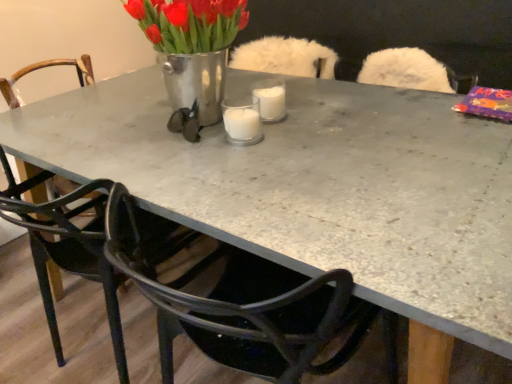
At what (x,y) coordinates should I click in order to perform the action: click on black plastic chair at lower left, positioned as the second chair in left-to-right order. Please return your answer as a coordinate pair (x, y). The width and height of the screenshot is (512, 384). Looking at the image, I should click on point(243,304).

This screenshot has height=384, width=512. Describe the element at coordinates (68, 249) in the screenshot. I see `black metal chair at center, arranged as the first chair when viewed from the left` at that location.

Measure the distance between clear glass candle at center and camera.

A distance of 1.09 meters exists between clear glass candle at center and camera.

Identify the location of black plastic chair at lower left, positioned as the second chair in left-to-right order. Image resolution: width=512 pixels, height=384 pixels. (243, 304).

Measure the distance between metallic vase at center and black plastic chair at lower left, positioned as the second chair in left-to-right order.

metallic vase at center and black plastic chair at lower left, positioned as the second chair in left-to-right order, are 20.07 inches apart from each other.

Is point (216, 121) closer or farther from the camera than point (327, 282)?

Point (216, 121).

Looking at this image, in the image, is metallic vase at center positioned in front of or behind black plastic chair at lower left, which is the first chair from right to left?

Visually, metallic vase at center is located behind black plastic chair at lower left, which is the first chair from right to left.

From a real-world perspective, is metallic vase at center physically below black plastic chair at lower left, which is the first chair from right to left?

Actually, metallic vase at center is physically above black plastic chair at lower left, which is the first chair from right to left, in the real world.

Relative to clear glass candle at center, is metallic vase at center in front or behind?

In the image, metallic vase at center appears in front of clear glass candle at center.

From the image's perspective, is metallic vase at center on top of clear glass candle at center?

Yes, from the image's perspective, metallic vase at center is on top of clear glass candle at center.

Is metallic vase at center facing away from clear glass candle at center?

No, clear glass candle at center is not at the back of metallic vase at center.

Which of these two, metallic vase at center or clear glass candle at center, stands taller?

Standing taller between the two is metallic vase at center.

Between black metal chair at center, arranged as the first chair when viewed from the left, and metallic vase at center, which one has smaller width?

With smaller width is metallic vase at center.

From the image's perspective, between black metal chair at center, acting as the second chair starting from the right, and metallic vase at center, which one is located above?

metallic vase at center appears higher in the image.

From their relative heights in the image, would you say black metal chair at center, arranged as the first chair when viewed from the left, is taller or shorter than metallic vase at center?

In the image, black metal chair at center, arranged as the first chair when viewed from the left, appears to be taller than metallic vase at center.

Which is more to the right, black metal chair at center, arranged as the first chair when viewed from the left, or metallic vase at center?

metallic vase at center.

Is black plastic chair at lower left, positioned as the second chair in left-to-right order, facing towards metallic vase at center?

No, black plastic chair at lower left, positioned as the second chair in left-to-right order, does not turn towards metallic vase at center.

How many degrees apart are the facing directions of black plastic chair at lower left, positioned as the second chair in left-to-right order, and metallic vase at center?

The facing directions of black plastic chair at lower left, positioned as the second chair in left-to-right order, and metallic vase at center are 180 degrees apart.

Is point (384, 313) closer or farther from the camera than point (223, 66)?

Point (384, 313) is positioned closer to the camera compared to point (223, 66).

Between black plastic chair at lower left, which is the first chair from right to left, and metallic vase at center, which one is positioned in front?

black plastic chair at lower left, which is the first chair from right to left, is more forward.

Is metallic vase at center a part of clear glass candle at center?

No, metallic vase at center is not inside clear glass candle at center.

Would you say clear glass candle at center is a long distance from metallic vase at center?

Actually, clear glass candle at center and metallic vase at center are a little close together.

From a real-world perspective, is clear glass candle at center below metallic vase at center?

Correct, in the physical world, clear glass candle at center is lower than metallic vase at center.

Is the depth of clear glass candle at center greater than that of metallic vase at center?

Yes, it is behind metallic vase at center.

Between clear glass candle at center and black metal chair at center, arranged as the first chair when viewed from the left, which one has smaller width?

clear glass candle at center is thinner.

Identify the location of candle holder above the black metal chair at center, arranged as the first chair when viewed from the left (from the image's perspective). (253, 111).

From a real-world perspective, relative to black metal chair at center, arranged as the first chair when viewed from the left, is clear glass candle at center vertically above or below?

clear glass candle at center is above black metal chair at center, arranged as the first chair when viewed from the left.

Is point (272, 104) closer to viewer compared to point (124, 347)?

Yes.

Is black metal chair at center, acting as the second chair starting from the right, completely or partially outside of black plastic chair at lower left, which is the first chair from right to left?

black metal chair at center, acting as the second chair starting from the right, is positioned outside black plastic chair at lower left, which is the first chair from right to left.

Can you confirm if black metal chair at center, acting as the second chair starting from the right, is shorter than black plastic chair at lower left, which is the first chair from right to left?

Yes, black metal chair at center, acting as the second chair starting from the right, is shorter than black plastic chair at lower left, which is the first chair from right to left.

Is black metal chair at center, arranged as the first chair when viewed from the left, oriented away from black plastic chair at lower left, positioned as the second chair in left-to-right order?

No, black metal chair at center, arranged as the first chair when viewed from the left,'s orientation is not away from black plastic chair at lower left, positioned as the second chair in left-to-right order.

In order to click on chair above the black plastic chair at lower left, which is the first chair from right to left (from the image's perspective) in this screenshot , I will do `click(68, 249)`.

Identify the location of floral arrangement above the black plastic chair at lower left, which is the first chair from right to left (from a real-world perspective). Image resolution: width=512 pixels, height=384 pixels. (192, 47).

The height and width of the screenshot is (384, 512). What are the coordinates of `candle holder below the metallic vase at center (from a real-world perspective)` in the screenshot? It's located at (253, 111).

From the image, which object appears to be nearer to clear glass candle at center, black plastic chair at lower left, which is the first chair from right to left, or black metal chair at center, arranged as the first chair when viewed from the left?

The object closer to clear glass candle at center is black plastic chair at lower left, which is the first chair from right to left.

Based on the photo, which object lies further to the anchor point clear glass candle at center, metallic vase at center or black metal chair at center, acting as the second chair starting from the right?

black metal chair at center, acting as the second chair starting from the right, lies further to clear glass candle at center than the other object.

Looking at the image, which one is located closer to black plastic chair at lower left, positioned as the second chair in left-to-right order, clear glass candle at center or black metal chair at center, arranged as the first chair when viewed from the left?

The object closer to black plastic chair at lower left, positioned as the second chair in left-to-right order, is black metal chair at center, arranged as the first chair when viewed from the left.

Considering their positions, is clear glass candle at center positioned further to black metal chair at center, acting as the second chair starting from the right, than metallic vase at center?

clear glass candle at center is positioned further to the anchor black metal chair at center, acting as the second chair starting from the right.

Based on their spatial positions, is metallic vase at center or black plastic chair at lower left, which is the first chair from right to left, further from black metal chair at center, acting as the second chair starting from the right?

metallic vase at center.

From the image, which object appears to be farther from metallic vase at center, black metal chair at center, arranged as the first chair when viewed from the left, or clear glass candle at center?

black metal chair at center, arranged as the first chair when viewed from the left, is further to metallic vase at center.

Based on their spatial positions, is black plastic chair at lower left, positioned as the second chair in left-to-right order, or clear glass candle at center closer to black metal chair at center, arranged as the first chair when viewed from the left?

black plastic chair at lower left, positioned as the second chair in left-to-right order.

When comparing their distances from clear glass candle at center, does black metal chair at center, acting as the second chair starting from the right, or metallic vase at center seem closer?

metallic vase at center lies closer to clear glass candle at center than the other object.

In order to click on chair between black plastic chair at lower left, which is the first chair from right to left, and clear glass candle at center, along the z-axis in this screenshot , I will do `click(68, 249)`.

Locate an element on the screen. This screenshot has height=384, width=512. chair between metallic vase at center and black plastic chair at lower left, which is the first chair from right to left, in the vertical direction is located at coordinates (68, 249).

Locate an element on the screen. The image size is (512, 384). candle holder between metallic vase at center and black metal chair at center, arranged as the first chair when viewed from the left, from top to bottom is located at coordinates (253, 111).

The height and width of the screenshot is (384, 512). Find the location of `candle holder that lies between metallic vase at center and black plastic chair at lower left, positioned as the second chair in left-to-right order, from top to bottom`. candle holder that lies between metallic vase at center and black plastic chair at lower left, positioned as the second chair in left-to-right order, from top to bottom is located at coordinates (253, 111).